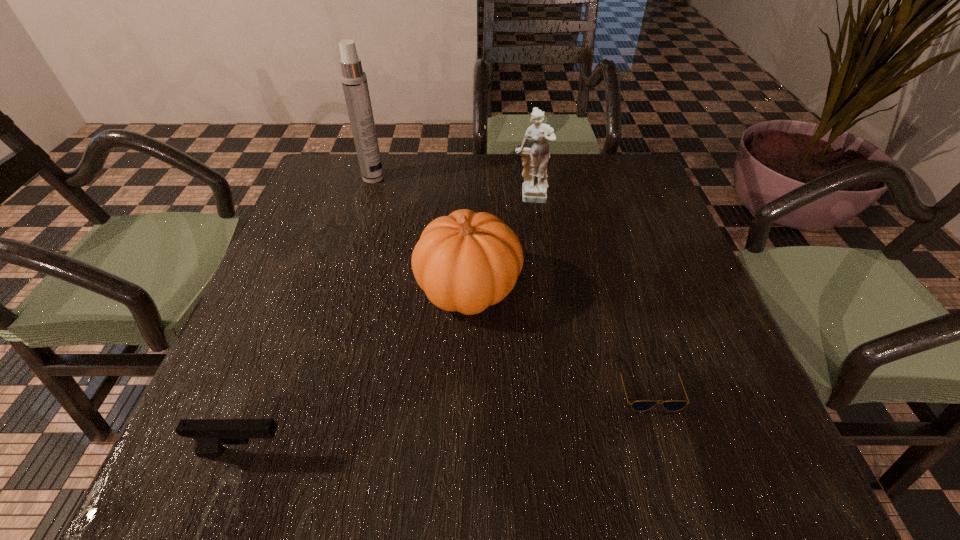
You are a GUI agent. You are given a task and a screenshot of the screen. Output one action in this format:
    pyautogui.click(x=<x>, y=<y>)
    Task: Click on the object that is at the right edge
    
    Given the screenshot: What is the action you would take?
    pyautogui.click(x=642, y=405)

Identify the location of object present at the far left corner. (354, 81).

At what (x,y) coordinates should I click in order to perform the action: click on object present at the near left corner. Please return your answer as a coordinate pair (x, y). Looking at the image, I should click on (210, 435).

Identify the location of free point at the far edge. Image resolution: width=960 pixels, height=540 pixels. [387, 158].

Image resolution: width=960 pixels, height=540 pixels. In the image, there is a desktop. Identify the location of free space at the near edge. (382, 482).

You are a GUI agent. You are given a task and a screenshot of the screen. Output one action in this format:
    pyautogui.click(x=<x>, y=<y>)
    Task: Click on the vacant region at the left edge of the desktop
    
    Given the screenshot: What is the action you would take?
    pyautogui.click(x=290, y=388)

This screenshot has width=960, height=540. Find the location of `free region at the right edge`. free region at the right edge is located at coordinates (682, 343).

This screenshot has height=540, width=960. Identify the location of free space at the far left corner. (308, 197).

In order to click on free region at the far right corner of the desktop in this screenshot , I will do `click(631, 158)`.

Find the location of a particular element. The width and height of the screenshot is (960, 540). free spot between the nearest object and the aerosol can is located at coordinates (309, 315).